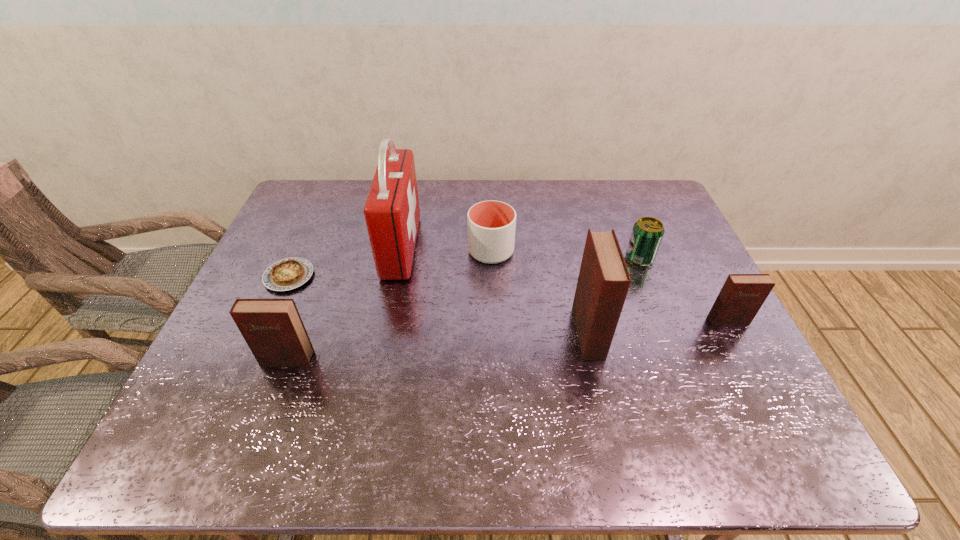
Locate an element on the screen. This screenshot has height=540, width=960. beer can is located at coordinates (647, 233).

I want to click on vacant space located 0.110m on the front cover of the third tallest object, so click(x=269, y=410).

Find the location of a particular element. The height and width of the screenshot is (540, 960). vacant region located on the front cover of the tallest diary is located at coordinates (704, 333).

What are the coordinates of `vacant space located on the front cover of the rightmost diary` in the screenshot? It's located at (738, 342).

Find the location of `free point located 0.360m on the front face of the first-aid kit`. free point located 0.360m on the front face of the first-aid kit is located at coordinates (536, 247).

Where is `free space located on the left of the fourth object from right to left`? Image resolution: width=960 pixels, height=540 pixels. free space located on the left of the fourth object from right to left is located at coordinates (419, 251).

Where is `vacant space positioned on the front of the quiche`? This screenshot has height=540, width=960. vacant space positioned on the front of the quiche is located at coordinates (257, 348).

Find the location of `vacant space located 0.220m on the back of the second object from right to left`. vacant space located 0.220m on the back of the second object from right to left is located at coordinates (619, 207).

The width and height of the screenshot is (960, 540). What are the coordinates of `object that is positioned at the far edge` in the screenshot? It's located at (392, 213).

Locate an element on the screen. The width and height of the screenshot is (960, 540). diary located in the left edge section of the desktop is located at coordinates (272, 328).